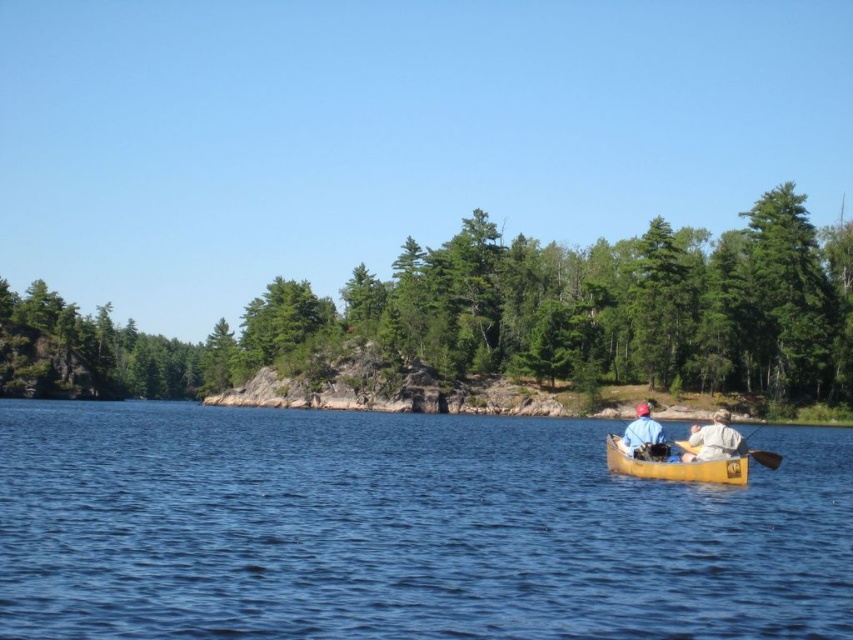
Can you confirm if blue water at center is smaller than light brown leather jacket at lower right?

Incorrect, blue water at center is not smaller in size than light brown leather jacket at lower right.

Is blue water at center to the right of light brown leather jacket at lower right from the viewer's perspective?

In fact, blue water at center is to the left of light brown leather jacket at lower right.

At what (x,y) coordinates should I click in order to perform the action: click on blue water at center. Please return your answer as a coordinate pair (x, y). Image resolution: width=853 pixels, height=640 pixels. Looking at the image, I should click on (402, 529).

You are a GUI agent. You are given a task and a screenshot of the screen. Output one action in this format:
    pyautogui.click(x=<x>, y=<y>)
    Task: Click on the blue water at center
    The image size is (853, 640).
    Given the screenshot: What is the action you would take?
    pyautogui.click(x=402, y=529)

Is point (204, 525) behind point (691, 465)?

No, it is not.

The width and height of the screenshot is (853, 640). I want to click on blue water at center, so click(402, 529).

Does point (809, 307) come in front of point (688, 444)?

No.

Does green leafy trees at center appear on the left side of light brown leather jacket at lower right?

In fact, green leafy trees at center is to the right of light brown leather jacket at lower right.

Does point (432, 285) come behind point (730, 436)?

That is True.

You are a GUI agent. You are given a task and a screenshot of the screen. Output one action in this format:
    pyautogui.click(x=<x>, y=<y>)
    Task: Click on the green leafy trees at center
    This screenshot has width=853, height=640.
    Given the screenshot: What is the action you would take?
    pyautogui.click(x=508, y=316)